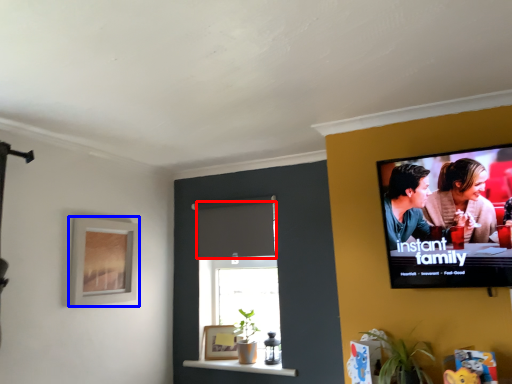
Question: Which object is closer to the camera taking this photo, curtain (highlighted by a red box) or picture frame (highlighted by a blue box)?

Choices:
 (A) curtain
 (B) picture frame

Answer: (B)